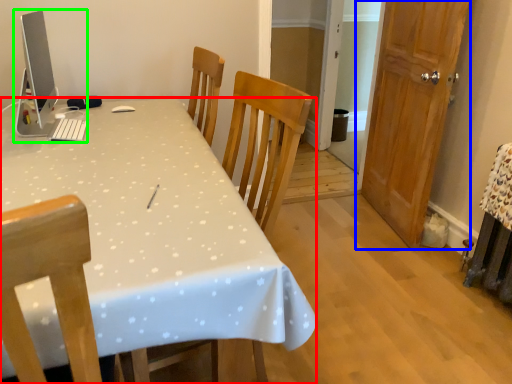
Question: Which object is the closest to the desk (highlighted by a red box)? Choose among these: door (highlighted by a blue box) or desktop computer (highlighted by a green box).

Choices:
 (A) door
 (B) desktop computer

Answer: (B)